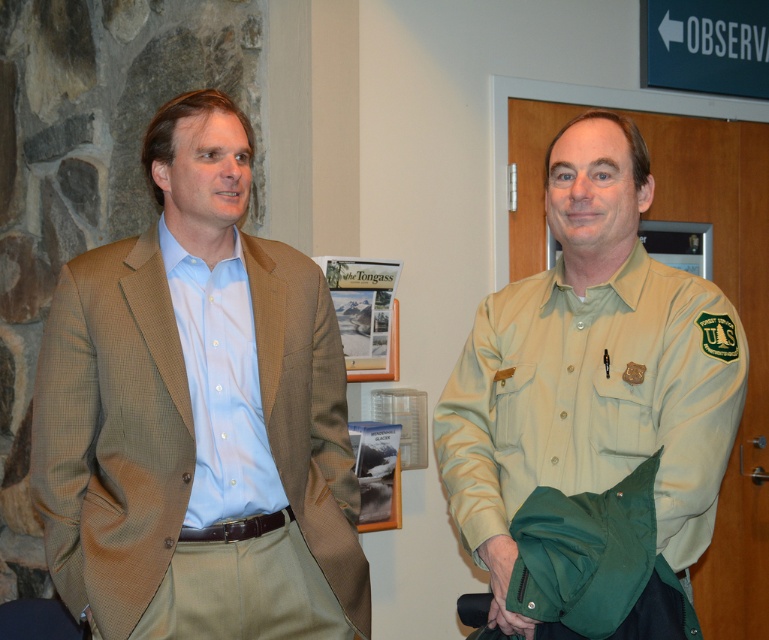
You are organizing a charity event and need to determine which of the two jackets can accommodate a larger name tag. Based on the image, which one between the light brown textured blazer at left and the khaki uniform shirt at right has a larger surface area for the name tag?

The light brown textured blazer at left has a larger surface area than the khaki uniform shirt at right, so it can accommodate a larger name tag.